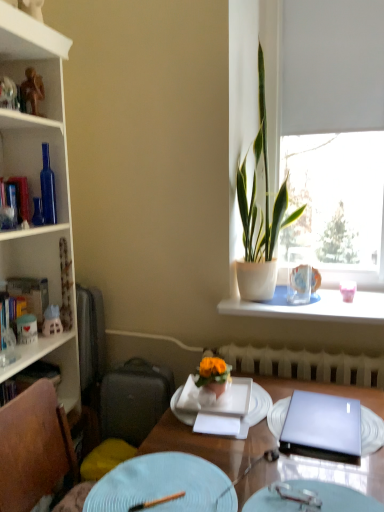
Locate an element on the screen. This screenshot has height=512, width=384. vacant space behind wooden chopstick at lower center, which appears as the 3th tableware when viewed from the right is located at coordinates (168, 466).